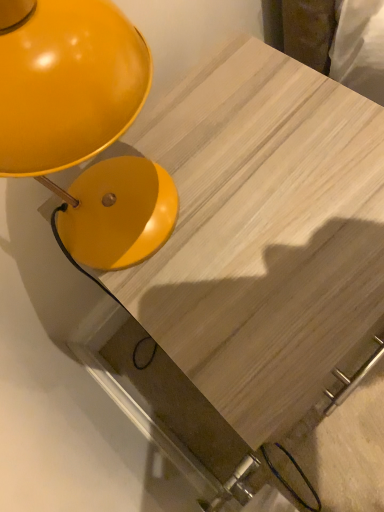
The height and width of the screenshot is (512, 384). In order to click on vacant area located to the right-hand side of glossy yellow lamp at upper left in this screenshot , I will do `click(260, 137)`.